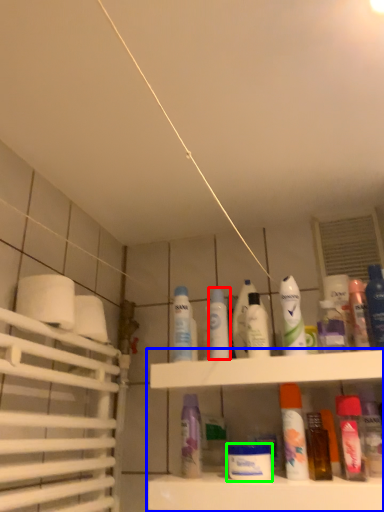
Question: Estimate the real-world distances between objects in this image. Which object is farther from mouthwash (highlighted by a red box), shelf (highlighted by a blue box) or mouthwash (highlighted by a green box)?

Choices:
 (A) shelf
 (B) mouthwash

Answer: (B)